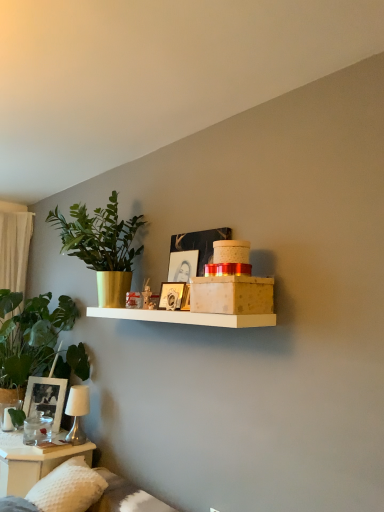
Question: From a real-world perspective, relative to clear glass water at lower left, is matte glass photo frame at lower left, arranged as the second picture frame when viewed from the front, vertically above or below?

Choices:
 (A) below
 (B) above

Answer: (B)

Question: From the image's perspective, relative to clear glass water at lower left, is matte glass photo frame at lower left, placed as the second picture frame when sorted from right to left, above or below?

Choices:
 (A) below
 (B) above

Answer: (B)

Question: Considering the real-world distances, which object is closest to the green leafy plant at left, the second houseplant viewed from the top?

Choices:
 (A) matte glass photo frame at lower left, arranged as the second picture frame when viewed from the front
 (B) matte gold picture frame at center, which is the 1th picture frame in front-to-back order
 (C) gold metallic pot at left, positioned as the 1th houseplant in top-to-bottom order
 (D) clear glass water at lower left
 (E) metallic silver table lamp at lower left

Answer: (A)

Question: Which object is positioned farthest from the green leafy plant at left, the second houseplant viewed from the top?

Choices:
 (A) white textured pillow at lower left
 (B) gold metallic pot at left, positioned as the 1th houseplant in top-to-bottom order
 (C) metallic silver table lamp at lower left
 (D) matte gold picture frame at center, placed as the 2th picture frame when sorted from bottom to top
 (E) clear glass water at lower left

Answer: (D)